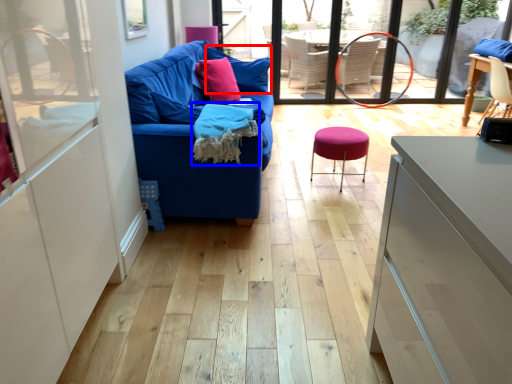
Question: Among these objects, which one is farthest to the camera, pillow (highlighted by a red box) or material (highlighted by a blue box)?

Choices:
 (A) pillow
 (B) material

Answer: (A)